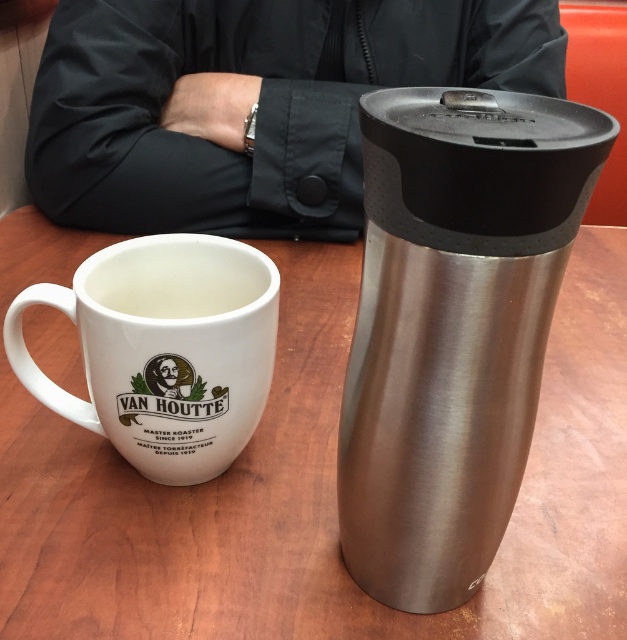
Which of these two, wooden table at center or white ceramic mug at left, stands taller?

Standing taller between the two is wooden table at center.

Does point (283, 634) come closer to viewer compared to point (236, 243)?

Yes, point (283, 634) is in front of point (236, 243).

In the scene shown: Who is more forward, (78,516) or (82,289)?

Point (82,289)

Locate an element on the screen. wooden table at center is located at coordinates (305, 483).

Consider the image. Is wooden table at center to the left of black fabric jacket at upper center from the viewer's perspective?

In fact, wooden table at center is to the right of black fabric jacket at upper center.

What do you see at coordinates (305, 483) in the screenshot? This screenshot has width=627, height=640. I see `wooden table at center` at bounding box center [305, 483].

The image size is (627, 640). What are the coordinates of `wooden table at center` in the screenshot? It's located at pyautogui.click(x=305, y=483).

Does brushed metal thermos at right appear on the right side of black fabric jacket at upper center?

Indeed, brushed metal thermos at right is positioned on the right side of black fabric jacket at upper center.

Who is higher up, brushed metal thermos at right or black fabric jacket at upper center?

black fabric jacket at upper center is higher up.

Locate an element on the screen. The width and height of the screenshot is (627, 640). brushed metal thermos at right is located at coordinates click(x=453, y=324).

Identify the location of brushed metal thermos at right. Image resolution: width=627 pixels, height=640 pixels. (453, 324).